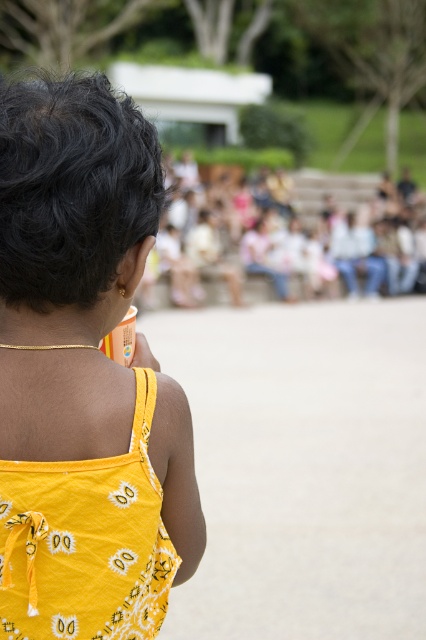
Question: From the image, what is the correct spatial relationship of yellow printed tank top at center in relation to yellow printed fabric dress at center?

Choices:
 (A) below
 (B) above

Answer: (B)

Question: Can you confirm if yellow printed tank top at center is positioned below yellow printed fabric dress at center?

Choices:
 (A) no
 (B) yes

Answer: (A)

Question: Is yellow printed tank top at center further to camera compared to yellow printed fabric dress at center?

Choices:
 (A) no
 (B) yes

Answer: (B)

Question: Among these objects, which one is farthest from the camera?

Choices:
 (A) yellow printed tank top at center
 (B) yellow printed fabric dress at center

Answer: (A)

Question: Which object is closer to the camera taking this photo?

Choices:
 (A) yellow printed fabric dress at center
 (B) yellow printed tank top at center

Answer: (A)